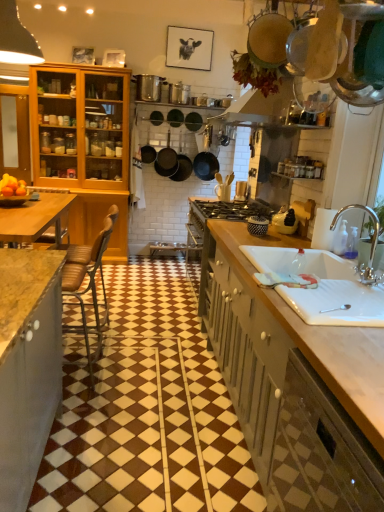
Question: From a real-world perspective, does matte black frying pan at center stand above wooden countertop at right, marked as the second cabinetry in a bottom-to-top arrangement?

Choices:
 (A) no
 (B) yes

Answer: (B)

Question: Considering the relative sizes of matte black frying pan at center and wooden countertop at right, the 2th cabinetry from the left, in the image provided, is matte black frying pan at center bigger than wooden countertop at right, the 2th cabinetry from the left,?

Choices:
 (A) no
 (B) yes

Answer: (A)

Question: Is matte black frying pan at center to the left of wooden countertop at right, which is the 2th cabinetry from top to bottom, from the viewer's perspective?

Choices:
 (A) yes
 (B) no

Answer: (A)

Question: Is matte black frying pan at center positioned with its back to wooden countertop at right, which is the 2th cabinetry from top to bottom?

Choices:
 (A) yes
 (B) no

Answer: (B)

Question: Considering the relative sizes of matte black frying pan at center and wooden countertop at right, positioned as the second cabinetry in front-to-back order, in the image provided, is matte black frying pan at center shorter than wooden countertop at right, positioned as the second cabinetry in front-to-back order,?

Choices:
 (A) yes
 (B) no

Answer: (A)

Question: From a real-world perspective, is silver metallic faucet at sink right above or below white ceramic sink at lower right?

Choices:
 (A) below
 (B) above

Answer: (B)

Question: Would you say silver metallic faucet at sink right is to the left or to the right of white ceramic sink at lower right in the picture?

Choices:
 (A) right
 (B) left

Answer: (A)

Question: Considering the positions of silver metallic faucet at sink right and white ceramic sink at lower right in the image, is silver metallic faucet at sink right wider or thinner than white ceramic sink at lower right?

Choices:
 (A) thin
 (B) wide

Answer: (A)

Question: Is point (374, 276) positioned closer to the camera than point (299, 290)?

Choices:
 (A) farther
 (B) closer

Answer: (A)

Question: Is silver metallic faucet at sink right inside or outside of wooden countertop at right, marked as the second cabinetry in a bottom-to-top arrangement?

Choices:
 (A) inside
 (B) outside

Answer: (B)

Question: Considering the positions of silver metallic faucet at sink right and wooden countertop at right, the 2th cabinetry from the left, in the image, is silver metallic faucet at sink right taller or shorter than wooden countertop at right, the 2th cabinetry from the left,?

Choices:
 (A) tall
 (B) short

Answer: (B)

Question: In terms of size, does silver metallic faucet at sink right appear bigger or smaller than wooden countertop at right, marked as the second cabinetry in a bottom-to-top arrangement?

Choices:
 (A) big
 (B) small

Answer: (B)

Question: From the image's perspective, relative to wooden countertop at right, the 2th cabinetry from the left, is silver metallic faucet at sink right above or below?

Choices:
 (A) below
 (B) above

Answer: (B)

Question: From their relative heights in the image, would you say silver metallic faucet at sink right is taller or shorter than matte wooden cabinet at left, which appears as the 3th cabinetry when viewed from the right?

Choices:
 (A) short
 (B) tall

Answer: (A)

Question: Considering the positions of silver metallic faucet at sink right and matte wooden cabinet at left, which is the first cabinetry in back-to-front order, in the image, is silver metallic faucet at sink right wider or thinner than matte wooden cabinet at left, which is the first cabinetry in back-to-front order,?

Choices:
 (A) thin
 (B) wide

Answer: (B)